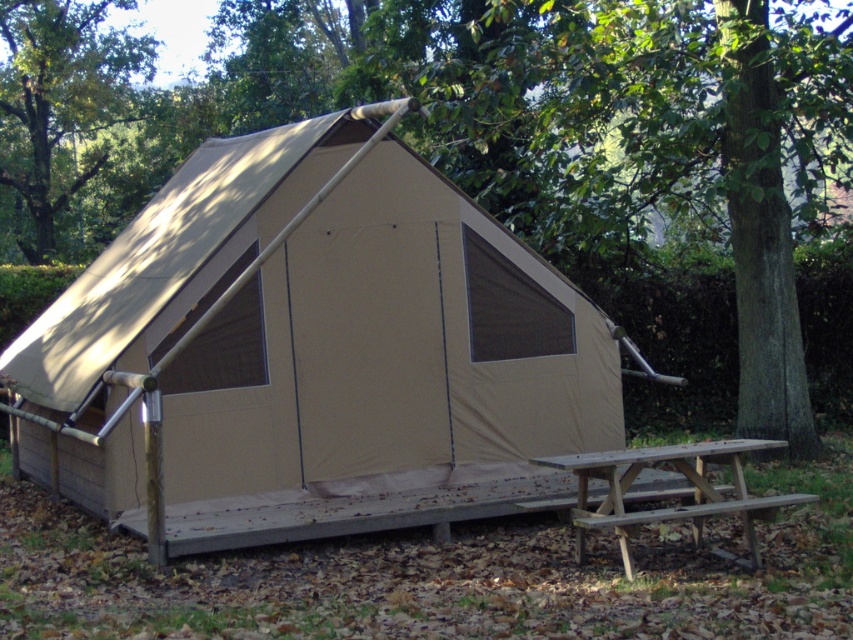
Does wooden picnic table at lower right have a greater width compared to wooden picnic table at lower center?

Yes, wooden picnic table at lower right is wider than wooden picnic table at lower center.

What are the coordinates of `wooden picnic table at lower right` in the screenshot? It's located at (666, 508).

Is point (648, 449) positioned in front of point (634, 492)?

Yes, it is.

Locate an element on the screen. Image resolution: width=853 pixels, height=640 pixels. wooden picnic table at lower right is located at coordinates (666, 508).

Between wooden picnic table at lower right and brown wooden bench at lower right, which one is positioned lower?

Positioned lower is brown wooden bench at lower right.

Is wooden picnic table at lower right smaller than brown wooden bench at lower right?

Incorrect, wooden picnic table at lower right is not smaller in size than brown wooden bench at lower right.

What do you see at coordinates (666, 508) in the screenshot? The width and height of the screenshot is (853, 640). I see `wooden picnic table at lower right` at bounding box center [666, 508].

This screenshot has height=640, width=853. I want to click on wooden picnic table at lower right, so click(x=666, y=508).

Who is positioned more to the left, tan canvas tent at center or wooden picnic table at lower center?

tan canvas tent at center is more to the left.

Does point (497, 355) lie behind point (531, 506)?

Yes, it is.

Is point (242, 136) closer to viewer compared to point (694, 497)?

No, it is behind (694, 497).

The height and width of the screenshot is (640, 853). I want to click on tan canvas tent at center, so click(x=306, y=339).